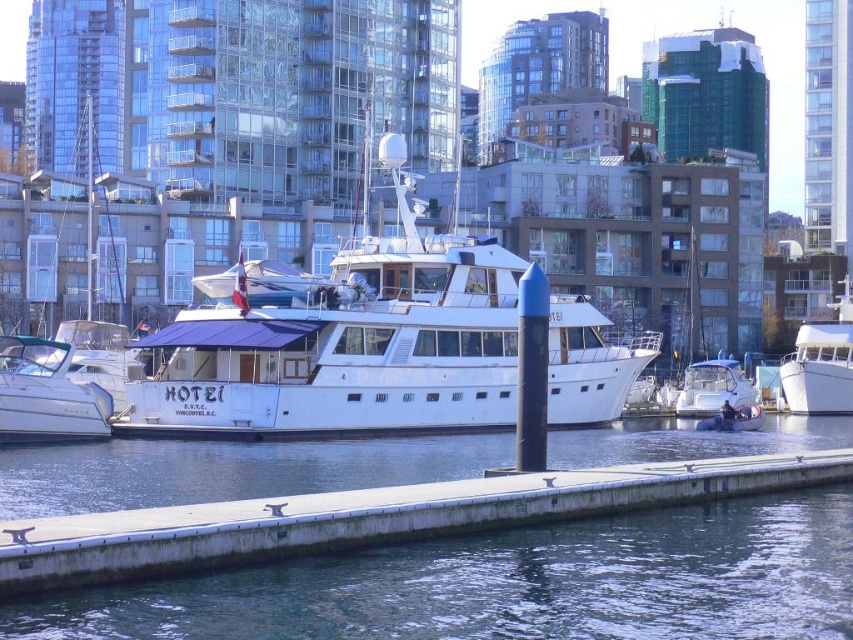
Does point (334, 465) come in front of point (708, 372)?

Yes, point (334, 465) is in front of point (708, 372).

Can you confirm if clear water at dock center is positioned to the right of white glossy motorboat at lower right?

In fact, clear water at dock center is to the left of white glossy motorboat at lower right.

Image resolution: width=853 pixels, height=640 pixels. Describe the element at coordinates (514, 584) in the screenshot. I see `clear water at dock center` at that location.

Where is `clear water at dock center`? clear water at dock center is located at coordinates (514, 584).

Is clear water at dock center thinner than white glossy motorboat at lower left?

No.

Is clear water at dock center wider than white glossy motorboat at lower left?

Yes, clear water at dock center is wider than white glossy motorboat at lower left.

Is point (718, 449) behind point (74, 408)?

That is True.

What are the coordinates of `clear water at dock center` in the screenshot? It's located at (514, 584).

Which is below, white matte boat at center or white glossy motorboat at lower right?

white glossy motorboat at lower right is below.

Identify the location of white matte boat at center. This screenshot has height=640, width=853. (345, 340).